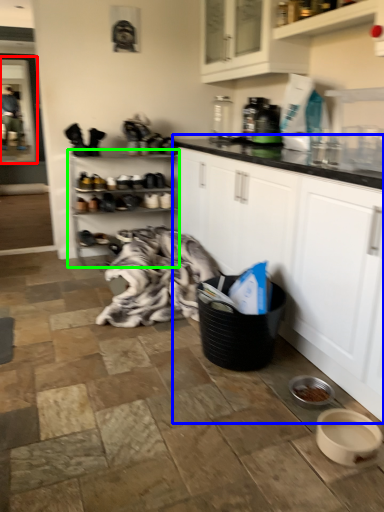
Question: Which object is positioned farthest from screen door (highlighted by a red box)? Select from cabinetry (highlighted by a blue box) and shelf (highlighted by a green box).

Choices:
 (A) cabinetry
 (B) shelf

Answer: (A)